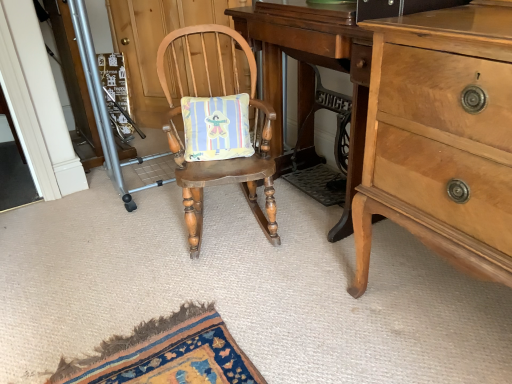
I want to click on vacant area that lies between light brown wood dresser at right and light brown wood changing table at center, so click(x=313, y=249).